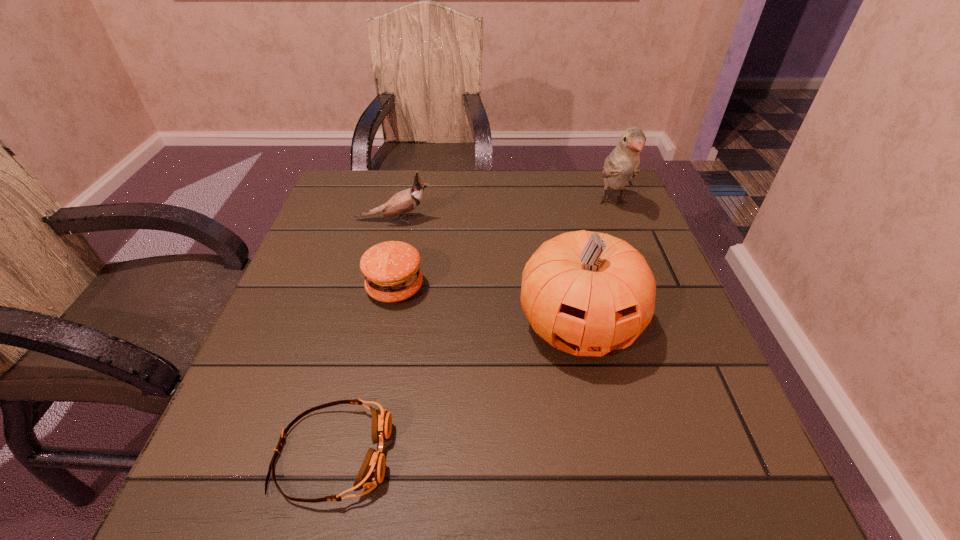
Locate an element on the screen. Image resolution: width=960 pixels, height=540 pixels. object at the far right corner is located at coordinates pos(623,163).

Identify the location of free space at the far edge of the desktop. The image size is (960, 540). (573, 216).

Identify the location of free location at the near edge. (329, 470).

Find the location of `vacant space at the left edge of the desktop`. vacant space at the left edge of the desktop is located at coordinates (314, 329).

The width and height of the screenshot is (960, 540). What are the coordinates of `vacant point at the right edge` in the screenshot? It's located at (640, 411).

The width and height of the screenshot is (960, 540). What are the coordinates of `free region at the far left corner of the desktop` in the screenshot? It's located at (351, 177).

Where is `free space between the nearest object and the patty`? The image size is (960, 540). free space between the nearest object and the patty is located at coordinates 364,371.

I want to click on blank region between the nearest object and the pumpkin, so click(455, 390).

You are a GUI agent. You are given a task and a screenshot of the screen. Output one action in this format:
    pyautogui.click(x=<x>, y=<y>)
    Task: Click on the free space between the second shortest object and the taller bird
    The height and width of the screenshot is (540, 960).
    Given the screenshot: What is the action you would take?
    click(x=504, y=245)

This screenshot has height=540, width=960. What are the coordinates of `vacant point located between the third tallest object and the pumpkin` in the screenshot? It's located at (486, 273).